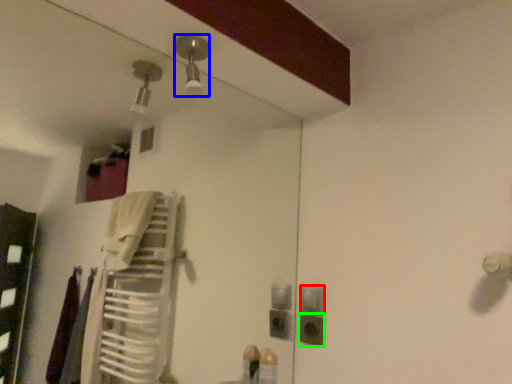
Question: Which object is positioned farthest from light switch (highlighted by a red box)? Select from light fixture (highlighted by a blue box) and electric outlet (highlighted by a green box).

Choices:
 (A) light fixture
 (B) electric outlet

Answer: (A)